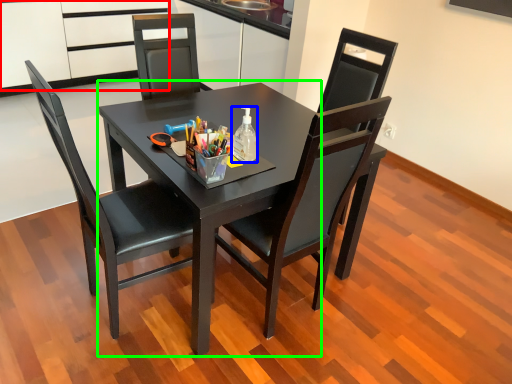
Question: Based on their relative distances, which object is farther from cabinetry (highlighted by a red box)? Choose from bottle (highlighted by a blue box) and round table (highlighted by a green box).

Choices:
 (A) bottle
 (B) round table

Answer: (A)